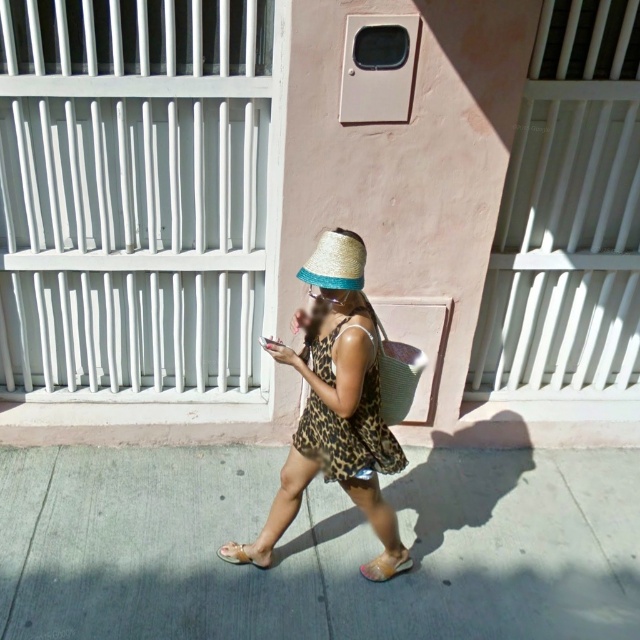
Based on the scene description, where is the straw at center located in terms of its 2D coordinates?

The straw at center is located at the 2D coordinates of point (x=336, y=260).

You are a fashion designer observing a person wearing a leopard print dress at center and a straw at center. Which item has a greater width?

The leopard print dress at center has a greater width than the straw at center.